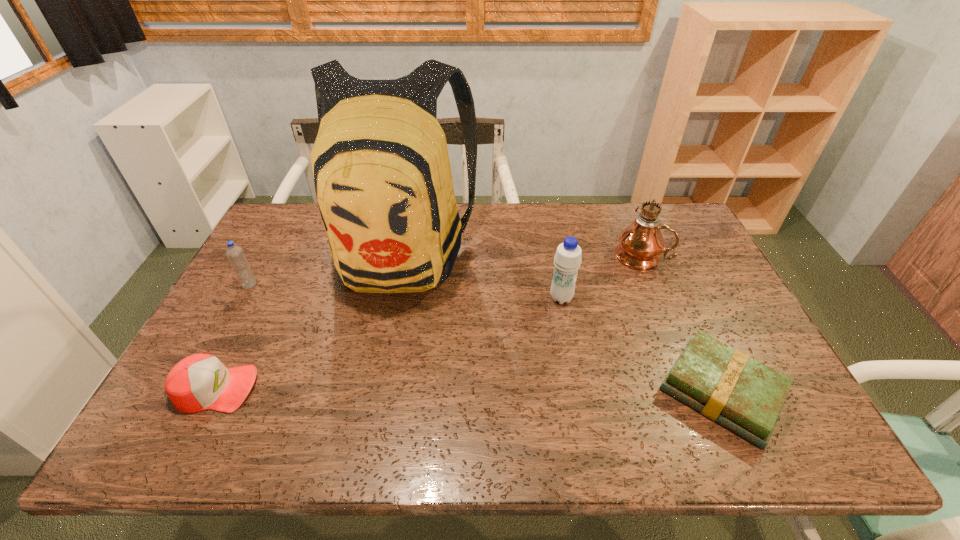
At what (x,y) coordinates should I click in order to perform the action: click on free space that satisfies the following two spatial constraints: 1. on the front side of the third tallest object; 2. on the front-facing side of the baseball cap. Please return your answer as a coordinate pair (x, y). The width and height of the screenshot is (960, 540). Looking at the image, I should click on (578, 388).

What are the coordinates of `vacant space that satisfies the following two spatial constraints: 1. on the front-facing side of the third object from left to right; 2. on the right side of the book` in the screenshot? It's located at [373, 392].